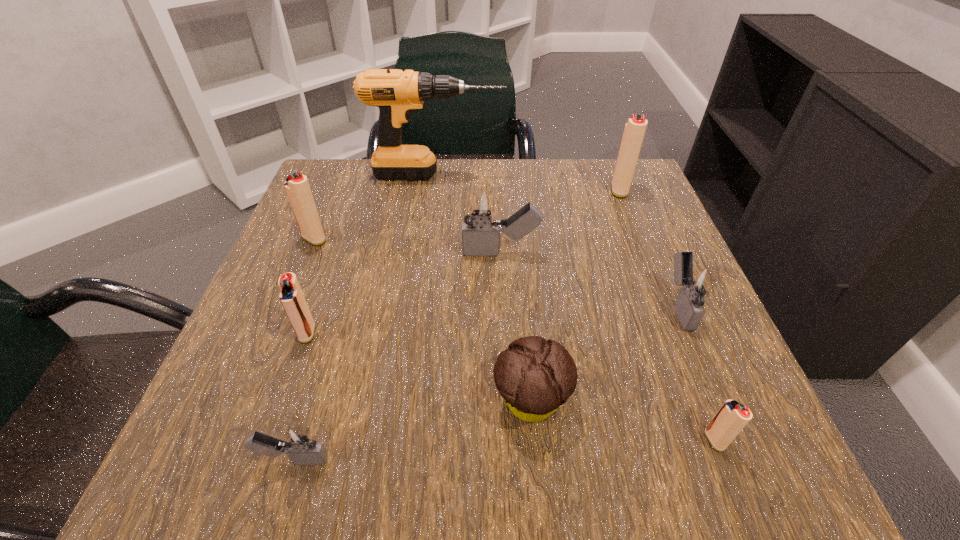
Identify the location of blank area in the image that satisfies the following two spatial constraints: 1. on the front side of the muffin; 2. on the left side of the smallest red igniter. (535, 440).

Where is `blank space that satisfies the following two spatial constraints: 1. on the back side of the nearest red igniter; 2. on the left side of the smallest gray igniter`? This screenshot has height=540, width=960. blank space that satisfies the following two spatial constraints: 1. on the back side of the nearest red igniter; 2. on the left side of the smallest gray igniter is located at coordinates (300, 440).